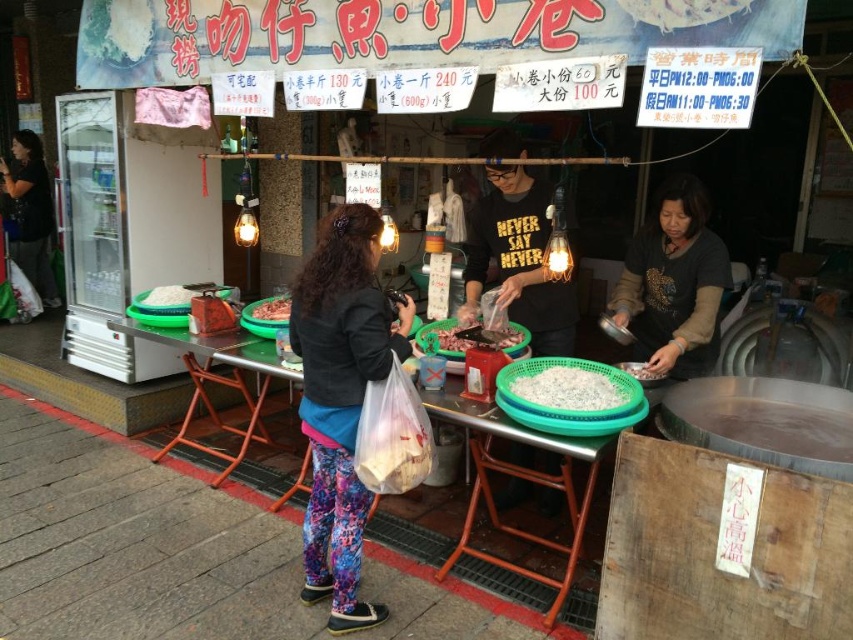
Is point (416, 337) more distant than point (659, 372)?

Yes, point (416, 337) is farther from viewer.

Does pinkish-red meat at center appear on the left side of white matte meat at center?

Yes, pinkish-red meat at center is to the left of white matte meat at center.

Which is behind, point (517, 339) or point (631, 374)?

Positioned behind is point (517, 339).

You are a GUI agent. You are given a task and a screenshot of the screen. Output one action in this format:
    pyautogui.click(x=<x>, y=<y>)
    Task: Click on the pinkish-red meat at center
    
    Given the screenshot: What is the action you would take?
    pyautogui.click(x=445, y=333)

Is pinkish matte meat at center to the right of white matte meat at center from the viewer's perspective?

In fact, pinkish matte meat at center is to the left of white matte meat at center.

Which is above, pinkish matte meat at center or white matte meat at center?

A: pinkish matte meat at center

Is point (450, 337) positioned behind point (635, 376)?

Yes, it is behind point (635, 376).

I want to click on pinkish matte meat at center, so click(x=445, y=339).

Where is `floral leggings at center`? The height and width of the screenshot is (640, 853). floral leggings at center is located at coordinates (341, 397).

Does floral leggings at center have a larger size compared to pinkish-red meat at center?

Correct, floral leggings at center is larger in size than pinkish-red meat at center.

Which is behind, point (318, 488) or point (461, 342)?

The point (461, 342) is behind.

Find the location of a particular element. floral leggings at center is located at coordinates (341, 397).